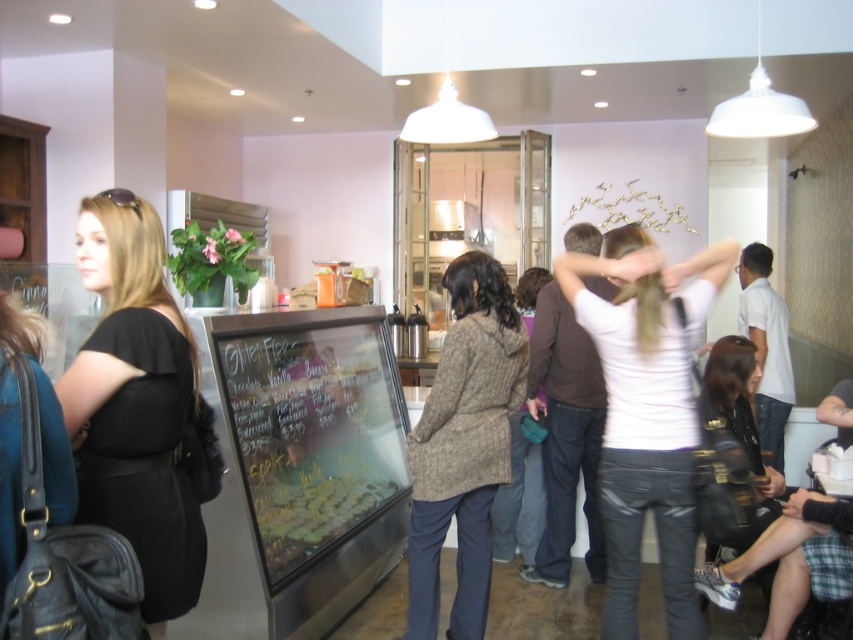
Question: Which object is closer to the camera taking this photo?

Choices:
 (A) green matte cookies at center
 (B) white matte shirt at center
 (C) black matte dress at left

Answer: (C)

Question: Based on their relative distances, which object is farther from the leather jacket at lower right?

Choices:
 (A) black glass menu board at center
 (B) white matte shirt at center
 (C) green matte cookies at center
 (D) knitted wool coat at center

Answer: (A)

Question: Estimate the real-world distances between objects in this image. Which object is farther from the green matte cookies at center?

Choices:
 (A) black glass menu board at center
 (B) leather jacket at lower right

Answer: (B)

Question: Is green matte cookies at center positioned in front of leather jacket at lower right?

Choices:
 (A) no
 (B) yes

Answer: (A)

Question: Is black matte dress at left positioned in front of leather jacket at lower right?

Choices:
 (A) yes
 (B) no

Answer: (A)

Question: Does black matte dress at left lie in front of knitted wool coat at center?

Choices:
 (A) no
 (B) yes

Answer: (B)